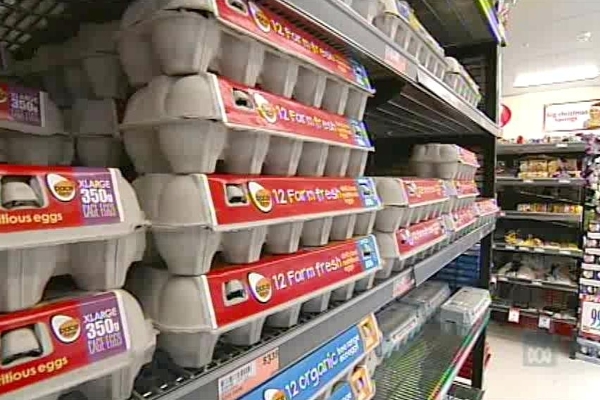
This screenshot has width=600, height=400. I want to click on bakery area, so click(x=543, y=163), click(x=525, y=194), click(x=533, y=238), click(x=531, y=264).